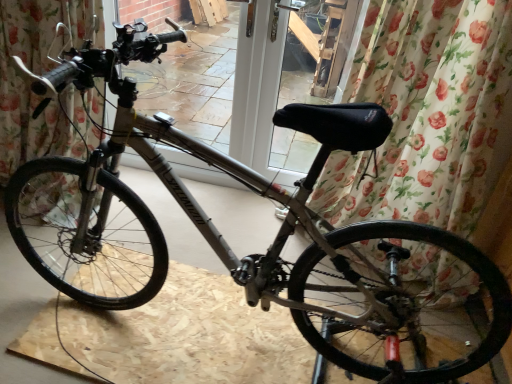
Question: Is the position of matte gray bicycle at center less distant than that of floral fabric curtain at center, the 2th curtain from the left?

Choices:
 (A) no
 (B) yes

Answer: (B)

Question: Can you confirm if matte gray bicycle at center is positioned to the left of floral fabric curtain at center, the 2th curtain from the left?

Choices:
 (A) yes
 (B) no

Answer: (A)

Question: Is matte gray bicycle at center outside floral fabric curtain at center, marked as the first curtain in a right-to-left arrangement?

Choices:
 (A) yes
 (B) no

Answer: (A)

Question: Would you say matte gray bicycle at center contains floral fabric curtain at center, the 2th curtain from the left?

Choices:
 (A) yes
 (B) no

Answer: (B)

Question: Can you confirm if matte gray bicycle at center is wider than floral fabric curtain at center, marked as the first curtain in a right-to-left arrangement?

Choices:
 (A) no
 (B) yes

Answer: (B)

Question: Is matte gray bicycle at center bigger than floral fabric curtain at center, marked as the first curtain in a right-to-left arrangement?

Choices:
 (A) no
 (B) yes

Answer: (A)

Question: Is matte gray bicycle at center at the left side of matte black handlebars at upper center?

Choices:
 (A) no
 (B) yes

Answer: (A)

Question: Considering the relative sizes of matte gray bicycle at center and matte black handlebars at upper center in the image provided, is matte gray bicycle at center taller than matte black handlebars at upper center?

Choices:
 (A) no
 (B) yes

Answer: (A)

Question: Is the position of matte gray bicycle at center less distant than that of matte black handlebars at upper center?

Choices:
 (A) yes
 (B) no

Answer: (A)

Question: Is there a large distance between matte gray bicycle at center and matte black handlebars at upper center?

Choices:
 (A) no
 (B) yes

Answer: (B)

Question: Is matte gray bicycle at center further to the viewer compared to matte black handlebars at upper center?

Choices:
 (A) yes
 (B) no

Answer: (B)

Question: Could you tell me if matte gray bicycle at center is turned towards matte black handlebars at upper center?

Choices:
 (A) yes
 (B) no

Answer: (B)

Question: Is matte gray bicycle at center at the back of matte black handlebars at upper center?

Choices:
 (A) yes
 (B) no

Answer: (B)